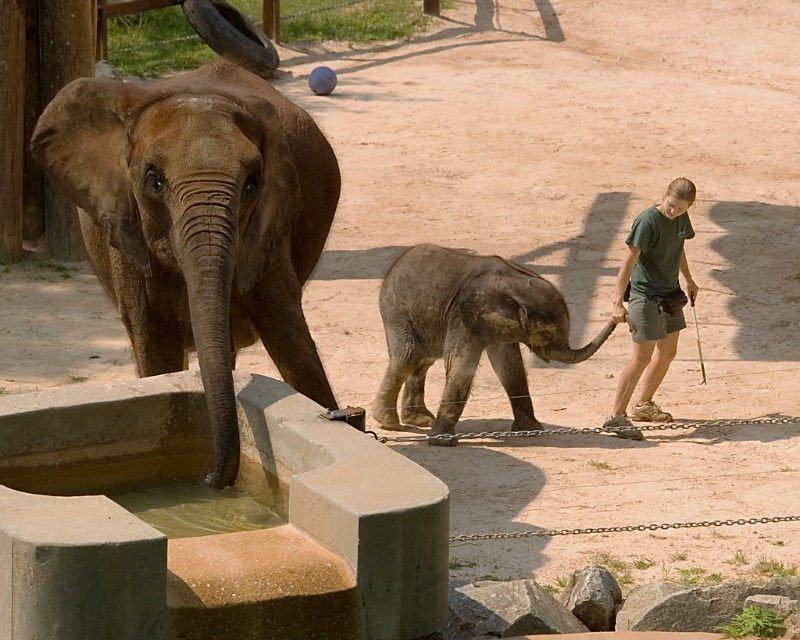
Between brown textured elephant at left and greenish murky water at elephant front, which one appears on the right side from the viewer's perspective?

greenish murky water at elephant front is more to the right.

Which is in front, point (170, 268) or point (172, 531)?

Point (172, 531) is more forward.

You are a GUI agent. You are given a task and a screenshot of the screen. Output one action in this format:
    pyautogui.click(x=<x>, y=<y>)
    Task: Click on the brown textured elephant at left
    This screenshot has height=640, width=800.
    Given the screenshot: What is the action you would take?
    pyautogui.click(x=200, y=221)

Who is taller, gray textured baby elephant at center or greenish murky water at elephant front?

gray textured baby elephant at center is taller.

Who is more forward, (500, 362) or (150, 493)?

Point (150, 493) is in front.

Is point (449, 400) positioned behind point (202, 516)?

That is True.

This screenshot has width=800, height=640. I want to click on gray textured baby elephant at center, so click(x=466, y=332).

Between gray textured baby elephant at center and green fabric shorts at right, which one appears on the left side from the viewer's perspective?

Positioned to the left is gray textured baby elephant at center.

Can you confirm if gray textured baby elephant at center is shorter than green fabric shorts at right?

Yes.

Does point (494, 266) lie in front of point (632, 259)?

Yes.

Where is `gray textured baby elephant at center`? The height and width of the screenshot is (640, 800). gray textured baby elephant at center is located at coordinates (466, 332).